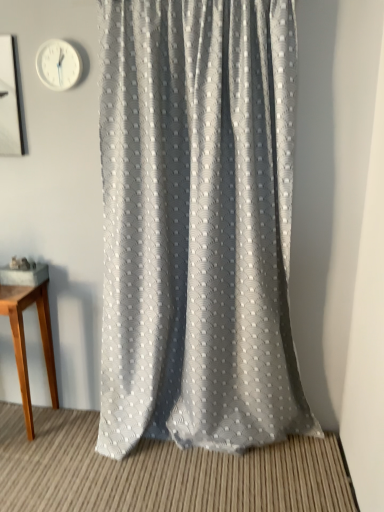
At what (x,y) coordinates should I click in order to perform the action: click on vacant area to the left of textured gray curtain at center. Please return your answer as a coordinate pair (x, y). The width and height of the screenshot is (384, 512). Looking at the image, I should click on (82, 465).